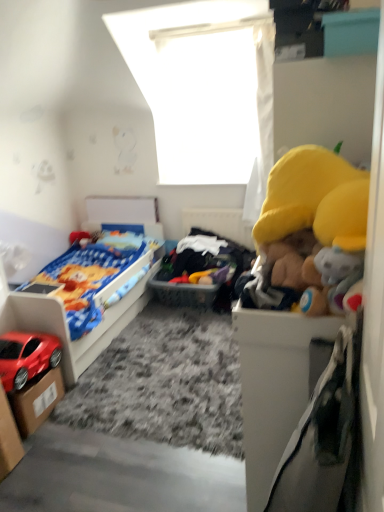
Question: From a real-world perspective, is shiny red car at lower left positioned over soft plush toys at center based on gravity?

Choices:
 (A) no
 (B) yes

Answer: (A)

Question: Is the depth of shiny red car at lower left less than that of soft plush toys at center?

Choices:
 (A) yes
 (B) no

Answer: (A)

Question: Is shiny red car at lower left to the left of soft plush toys at center from the viewer's perspective?

Choices:
 (A) yes
 (B) no

Answer: (A)

Question: Can you confirm if shiny red car at lower left is bigger than soft plush toys at center?

Choices:
 (A) yes
 (B) no

Answer: (B)

Question: Is there a large distance between shiny red car at lower left and soft plush toys at center?

Choices:
 (A) yes
 (B) no

Answer: (A)

Question: Is cardboard box at lower left, the first storage box when ordered from front to back, in front of or behind matte plastic bed at left in the image?

Choices:
 (A) behind
 (B) front

Answer: (B)

Question: From a real-world perspective, is cardboard box at lower left, the first storage box when ordered from front to back, physically located above or below matte plastic bed at left?

Choices:
 (A) below
 (B) above

Answer: (A)

Question: Is cardboard box at lower left, which is the second storage box from back to front, taller or shorter than matte plastic bed at left?

Choices:
 (A) tall
 (B) short

Answer: (B)

Question: From the image's perspective, is cardboard box at lower left, the first storage box when ordered from front to back, positioned above or below matte plastic bed at left?

Choices:
 (A) above
 (B) below

Answer: (B)

Question: Considering the positions of point (160, 290) and point (9, 453), is point (160, 290) closer or farther from the camera than point (9, 453)?

Choices:
 (A) closer
 (B) farther

Answer: (B)

Question: From a real-world perspective, is soft plush toys at center positioned above or below cardboard box at lower left, which is the second storage box from back to front?

Choices:
 (A) above
 (B) below

Answer: (A)

Question: Considering the relative positions of soft plush toys at center and cardboard box at lower left, which is the second storage box from back to front, in the image provided, is soft plush toys at center to the left or to the right of cardboard box at lower left, which is the second storage box from back to front,?

Choices:
 (A) left
 (B) right

Answer: (B)

Question: From the image's perspective, is soft plush toys at center positioned above or below cardboard box at lower left, the first storage box when ordered from front to back?

Choices:
 (A) above
 (B) below

Answer: (A)

Question: Is point pyautogui.click(x=147, y=282) closer or farther from the camera than point pyautogui.click(x=39, y=423)?

Choices:
 (A) farther
 (B) closer

Answer: (A)

Question: Is soft plush toys at center spatially inside cardboard box at lower left, the 1th storage box when ordered from back to front, or outside of it?

Choices:
 (A) inside
 (B) outside

Answer: (B)